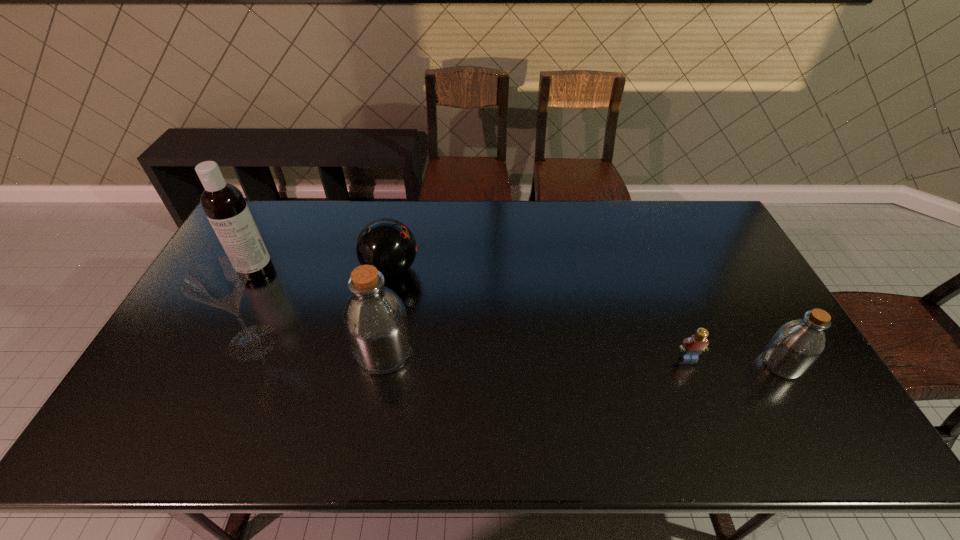
The height and width of the screenshot is (540, 960). What are the coordinates of `the left bottle` in the screenshot? It's located at (375, 321).

At what (x,y) coordinates should I click in order to perform the action: click on the right bottle. Please return your answer as a coordinate pair (x, y). This screenshot has width=960, height=540. Looking at the image, I should click on (795, 347).

The width and height of the screenshot is (960, 540). Identify the location of the rightmost object. (795, 347).

At what (x,y) coordinates should I click in order to perform the action: click on the tallest object. Please return your answer as a coordinate pair (x, y). This screenshot has width=960, height=540. Looking at the image, I should click on (224, 205).

You are a GUI agent. You are given a task and a screenshot of the screen. Output one action in this format:
    pyautogui.click(x=<x>, y=<y>)
    Task: Click on the bowling ball
    This screenshot has width=960, height=540.
    Given the screenshot: What is the action you would take?
    pyautogui.click(x=387, y=244)

You are a GUI agent. You are given a task and a screenshot of the screen. Output one action in this format:
    pyautogui.click(x=<x>, y=<y>)
    Task: Click on the flute glass
    This screenshot has height=540, width=960.
    Given the screenshot: What is the action you would take?
    pyautogui.click(x=220, y=282)

At what (x,y) coordinates should I click in order to perform the action: click on Lego. Please return your answer as a coordinate pair (x, y). The height and width of the screenshot is (540, 960). Looking at the image, I should click on (692, 347).

Find the location of `the shortest object`. the shortest object is located at coordinates (692, 347).

Where is `vacant region located 0.340m on the right of the left bottle`? Image resolution: width=960 pixels, height=540 pixels. vacant region located 0.340m on the right of the left bottle is located at coordinates [x=538, y=352].

Locate an element on the screen. vacant area situated on the left of the right bottle is located at coordinates (684, 363).